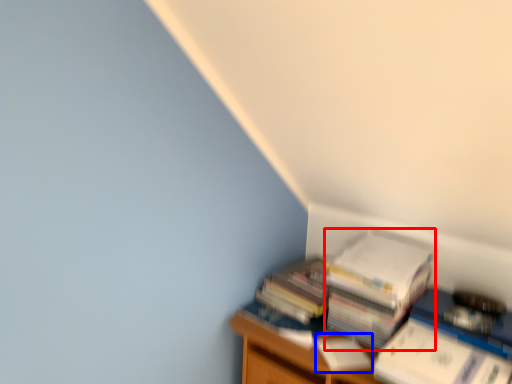
Question: Among these objects, which one is farthest to the camera, paperback book (highlighted by a red box) or paperback book (highlighted by a blue box)?

Choices:
 (A) paperback book
 (B) paperback book

Answer: (A)